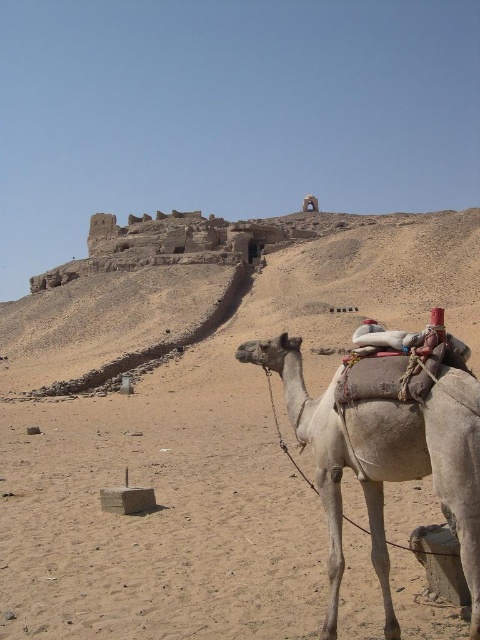
Does beige sandy desert at center appear over light beige textured camel at lower right?

Yes.

Does beige sandy desert at center appear on the right side of light beige textured camel at lower right?

In fact, beige sandy desert at center is to the left of light beige textured camel at lower right.

At what (x,y) coordinates should I click in order to perform the action: click on beige sandy desert at center. Please return your answer as a coordinate pair (x, y). Looking at the image, I should click on (212, 454).